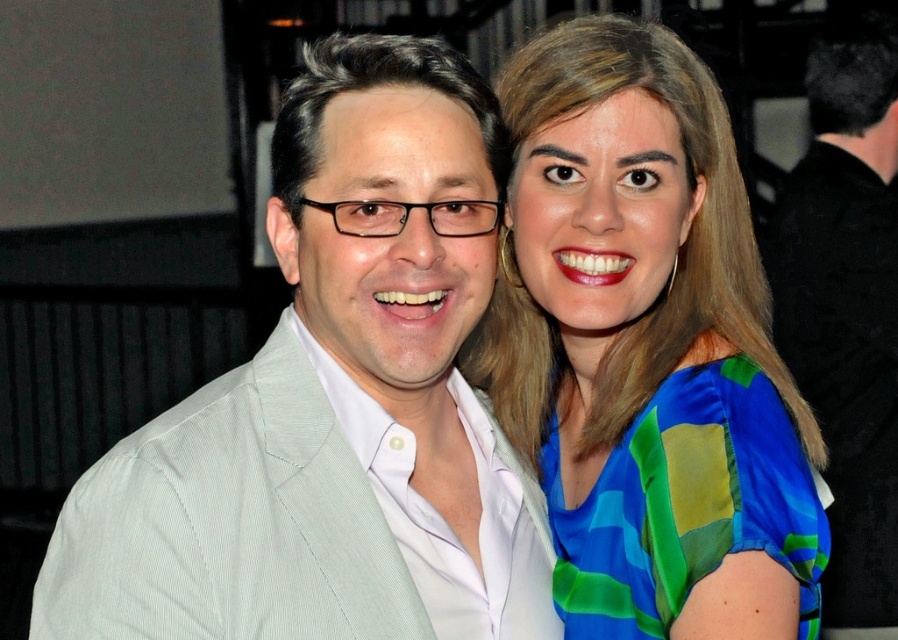
You are taking a photo of two people standing at point [421,68] and point [516,93]. Which point is closer to the camera?

Point [421,68] is in front of point [516,93], so it is closer to the camera.